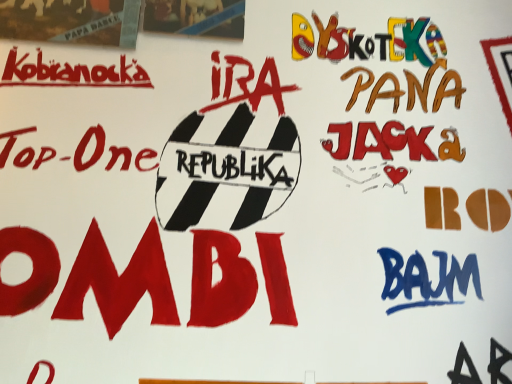
Question: From the image's perspective, does matte cardboard poster at upper left, acting as the 1th poster starting from the right, appear higher than matte cardboard poster at upper left, the 1th poster when ordered from left to right?

Choices:
 (A) yes
 (B) no

Answer: (A)

Question: Is matte cardboard poster at upper left, which is the second poster in left-to-right order, to the left of matte cardboard poster at upper left, the 1th poster when ordered from left to right, from the viewer's perspective?

Choices:
 (A) no
 (B) yes

Answer: (A)

Question: Does matte cardboard poster at upper left, acting as the 1th poster starting from the right, have a larger size compared to matte cardboard poster at upper left, the 1th poster when ordered from left to right?

Choices:
 (A) no
 (B) yes

Answer: (A)

Question: Can you confirm if matte cardboard poster at upper left, which is the second poster in left-to-right order, is positioned to the right of matte cardboard poster at upper left, the second poster in the right-to-left sequence?

Choices:
 (A) no
 (B) yes

Answer: (B)

Question: Considering the relative sizes of matte cardboard poster at upper left, which is the second poster in left-to-right order, and matte cardboard poster at upper left, the 1th poster when ordered from left to right, in the image provided, is matte cardboard poster at upper left, which is the second poster in left-to-right order, smaller than matte cardboard poster at upper left, the 1th poster when ordered from left to right,?

Choices:
 (A) yes
 (B) no

Answer: (A)

Question: From a real-world perspective, is matte cardboard poster at upper left, which is the second poster in left-to-right order, over matte cardboard poster at upper left, the 1th poster when ordered from left to right?

Choices:
 (A) no
 (B) yes

Answer: (B)

Question: Does matte cardboard poster at upper left, the 1th poster when ordered from left to right, have a lesser width compared to matte cardboard poster at upper left, which is the second poster in left-to-right order?

Choices:
 (A) no
 (B) yes

Answer: (B)

Question: From the image's perspective, is matte cardboard poster at upper left, the 1th poster when ordered from left to right, under matte cardboard poster at upper left, which is the second poster in left-to-right order?

Choices:
 (A) no
 (B) yes

Answer: (B)

Question: Is matte cardboard poster at upper left, the 1th poster when ordered from left to right, touching matte cardboard poster at upper left, which is the second poster in left-to-right order?

Choices:
 (A) yes
 (B) no

Answer: (B)

Question: Does matte cardboard poster at upper left, the second poster in the right-to-left sequence, turn towards matte cardboard poster at upper left, which is the second poster in left-to-right order?

Choices:
 (A) no
 (B) yes

Answer: (A)

Question: Is matte cardboard poster at upper left, the second poster in the right-to-left sequence, not close to matte cardboard poster at upper left, acting as the 1th poster starting from the right?

Choices:
 (A) no
 (B) yes

Answer: (A)

Question: Does matte cardboard poster at upper left, the second poster in the right-to-left sequence, have a smaller size compared to matte cardboard poster at upper left, which is the second poster in left-to-right order?

Choices:
 (A) yes
 (B) no

Answer: (B)

Question: Is matte cardboard poster at upper left, the second poster in the right-to-left sequence, taller or shorter than matte cardboard poster at upper left, acting as the 1th poster starting from the right?

Choices:
 (A) short
 (B) tall

Answer: (B)